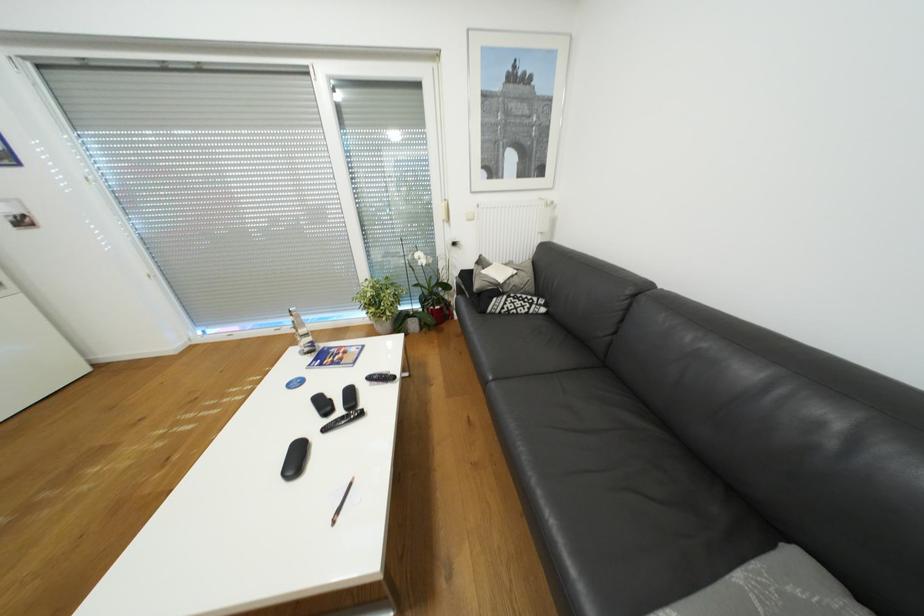
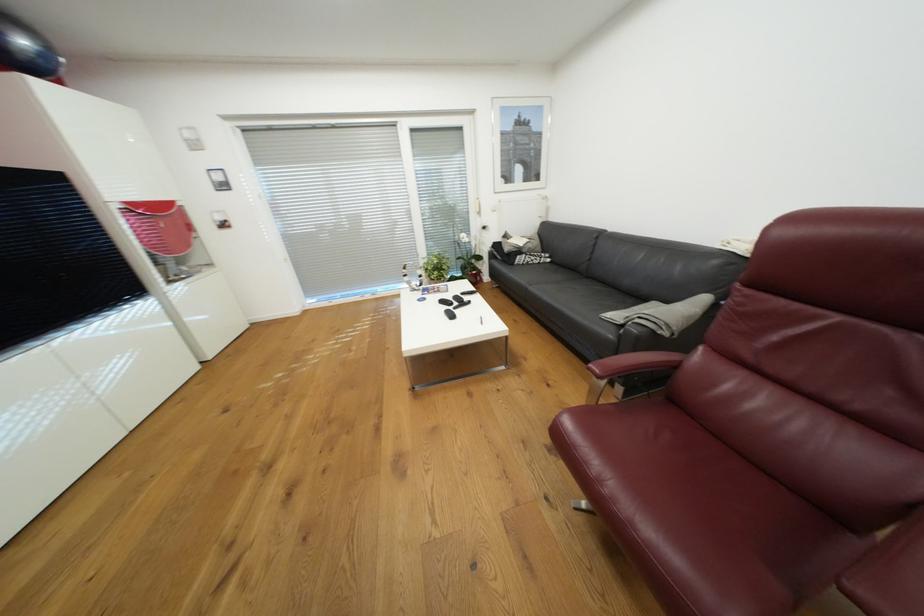
The point at (379,310) is marked in the first image. Where is the corresponding point in the second image?

(443, 273)